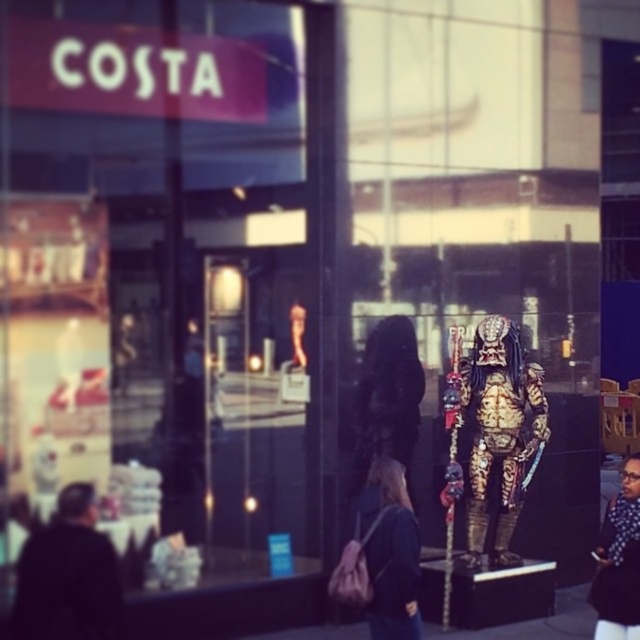
Looking at this image, does gold metallic predator at center come behind dark blue fabric jacket at lower right?

Yes, gold metallic predator at center is behind dark blue fabric jacket at lower right.

Between gold metallic predator at center and dark blue fabric jacket at lower right, which one is positioned higher?

gold metallic predator at center is higher up.

You are a GUI agent. You are given a task and a screenshot of the screen. Output one action in this format:
    pyautogui.click(x=<x>, y=<y>)
    Task: Click on the gold metallic predator at center
    Image resolution: width=640 pixels, height=640 pixels.
    Given the screenshot: What is the action you would take?
    pyautogui.click(x=493, y=435)

Which of these two, gold metallic predator at center or matte black jacket at center, stands taller?

gold metallic predator at center is taller.

Is gold metallic predator at center thinner than matte black jacket at center?

In fact, gold metallic predator at center might be wider than matte black jacket at center.

Find the location of a particular element. gold metallic predator at center is located at coordinates (493, 435).

Locate an element on the screen. The height and width of the screenshot is (640, 640). gold metallic predator at center is located at coordinates (493, 435).

Between matte black jacket at center and dark blue fabric jacket at lower right, which one has less height?

Standing shorter between the two is matte black jacket at center.

This screenshot has width=640, height=640. Find the location of `matte black jacket at center`. matte black jacket at center is located at coordinates (381, 556).

Who is more forward, (x=381, y=468) or (x=596, y=636)?

Point (x=596, y=636)

Locate an element on the screen. matte black jacket at center is located at coordinates (381, 556).